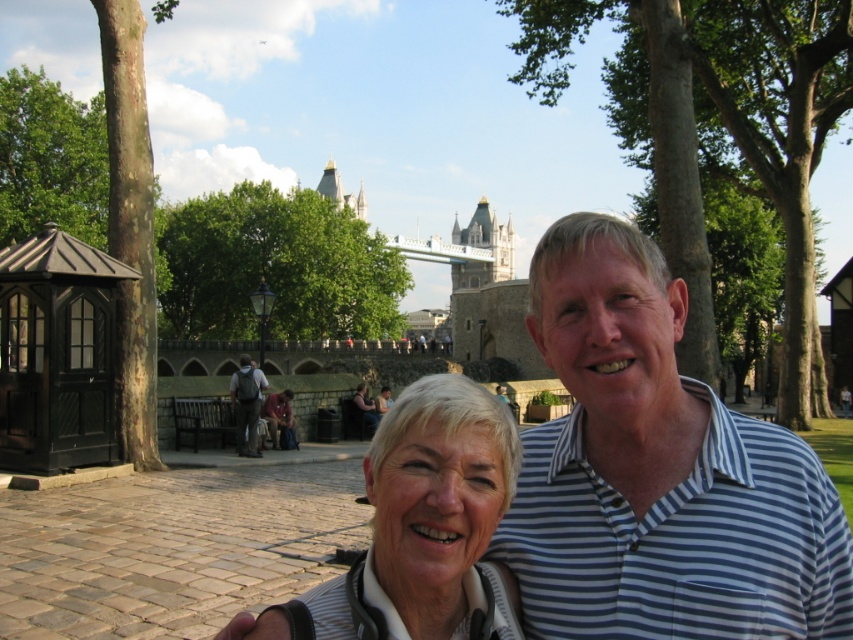
From the picture: Between white matte hair at center and blonde hair at center, which one is positioned lower?

white matte hair at center

Is white matte hair at center positioned behind blonde hair at center?

No.

Between point (415, 472) and point (376, 397), which one is positioned behind?

Point (376, 397)

In order to click on white matte hair at center in this screenshot , I will do `click(428, 516)`.

Which of these two, black wood gazebo at left or blonde hair at center, stands taller?

black wood gazebo at left is taller.

Can you confirm if black wood gazebo at left is positioned below blonde hair at center?

Incorrect, black wood gazebo at left is not positioned below blonde hair at center.

Is point (91, 444) positioned in front of point (361, 384)?

Yes, point (91, 444) is closer to viewer.

I want to click on black wood gazebo at left, so click(x=57, y=353).

Does white matte hair at center have a greater width compared to dark gray backpack at center?

Yes.

Is white matte hair at center taller than dark gray backpack at center?

Yes.

Is point (450, 605) closer to viewer compared to point (242, 422)?

Yes, it is.

Find the location of `white matte hair at center`. white matte hair at center is located at coordinates [x=428, y=516].